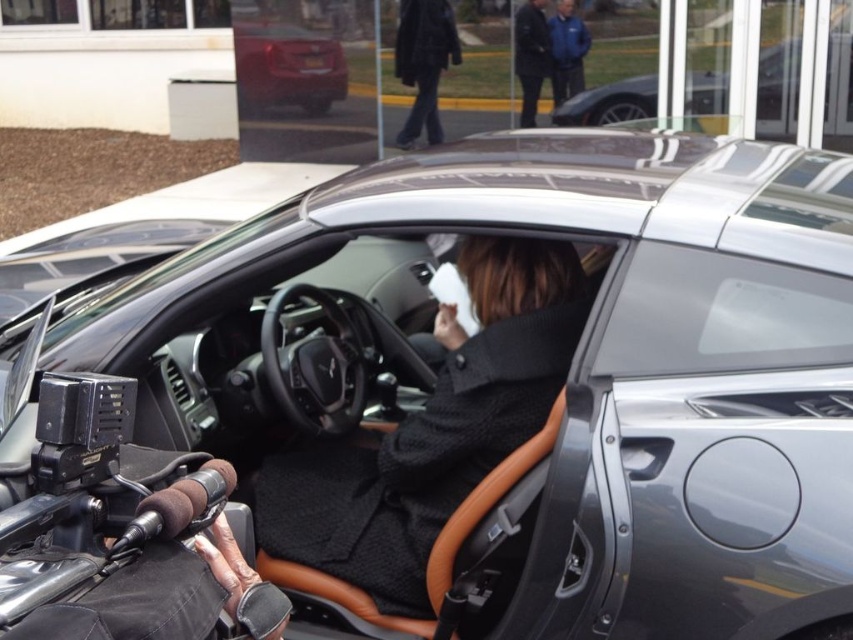
Does black wool coat at center have a lesser width compared to shiny red car at upper left?

No.

At what (x,y) coordinates should I click in order to perform the action: click on black wool coat at center. Please return your answer as a coordinate pair (x, y). The height and width of the screenshot is (640, 853). Looking at the image, I should click on (433, 429).

Locate an element on the screen. black wool coat at center is located at coordinates (433, 429).

Who is higher up, dark blue jacket at upper center or blue fabric jacket at upper center?

Positioned higher is blue fabric jacket at upper center.

Is point (527, 58) in front of point (584, 36)?

No, it is not.

Describe the element at coordinates (531, 54) in the screenshot. The image size is (853, 640). I see `dark blue jacket at upper center` at that location.

I want to click on dark blue jacket at upper center, so click(531, 54).

Does point (460, 54) come behind point (531, 44)?

Yes, it is behind point (531, 44).

Which is in front, point (428, 38) or point (519, 74)?

Point (519, 74) is more forward.

Which is behind, point (413, 138) or point (549, 76)?

Positioned behind is point (413, 138).

This screenshot has height=640, width=853. I want to click on dark gray pants at upper center, so click(424, 61).